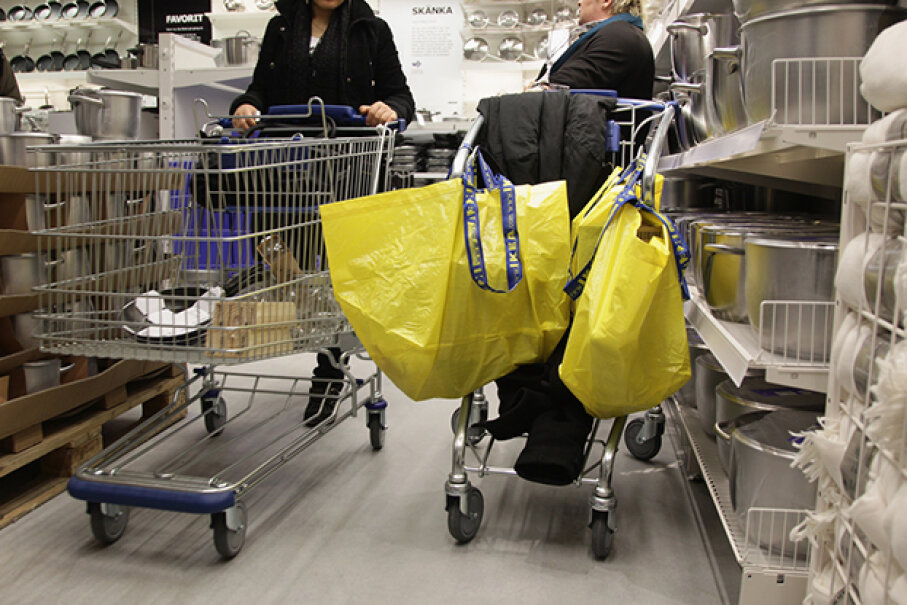
Where is `grey labels on rolled up throw blankets`? grey labels on rolled up throw blankets is located at coordinates (899, 129), (883, 172), (873, 269), (863, 365), (850, 469), (854, 554), (843, 593).